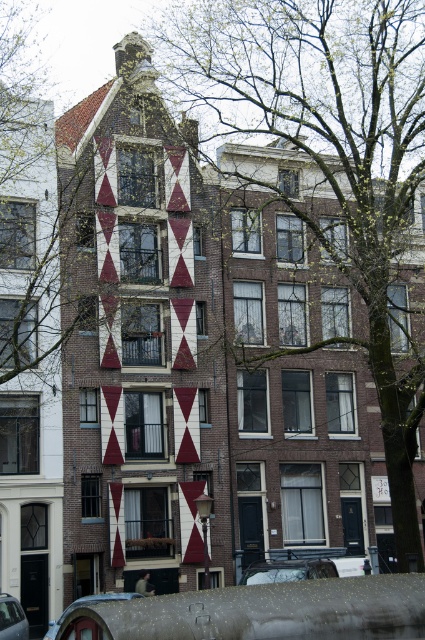
Question: Which object appears closest to the camera in this image?

Choices:
 (A) metallic silver car at lower center
 (B) metallic silver car at lower left

Answer: (B)

Question: Is metallic silver car at lower center smaller than metallic silver car at lower left?

Choices:
 (A) yes
 (B) no

Answer: (B)

Question: Among these objects, which one is nearest to the camera?

Choices:
 (A) metallic silver car at lower center
 (B) metallic silver car at lower left

Answer: (B)

Question: Can you confirm if metallic silver car at lower center is thinner than metallic silver car at lower left?

Choices:
 (A) yes
 (B) no

Answer: (B)

Question: Is metallic silver car at lower center closer to camera compared to metallic silver car at lower left?

Choices:
 (A) no
 (B) yes

Answer: (A)

Question: Which object is closer to the camera taking this photo?

Choices:
 (A) metallic silver car at lower center
 (B) metallic silver car at lower left

Answer: (B)